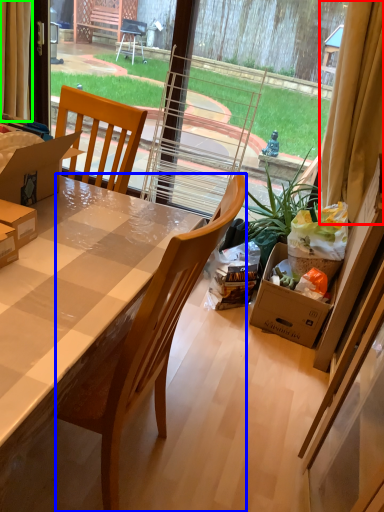
Question: Considering the real-world distances, which object is farthest from curtain (highlighted by a red box)? chair (highlighted by a blue box) or curtain (highlighted by a green box)?

Choices:
 (A) chair
 (B) curtain

Answer: (B)